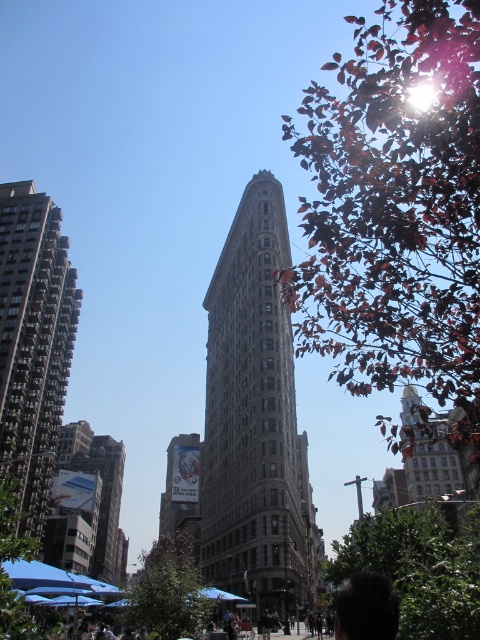
Question: Among these objects, which one is farthest from the camera?

Choices:
 (A) white glossy billboard at center
 (B) green leafy tree at lower right

Answer: (A)

Question: Observing the image, what is the correct spatial positioning of green leafy tree at upper right in reference to white glossy billboard at center?

Choices:
 (A) below
 (B) above

Answer: (B)

Question: Considering the relative positions of green leafy tree at lower center and white glossy billboard at center in the image provided, where is green leafy tree at lower center located with respect to white glossy billboard at center?

Choices:
 (A) above
 (B) below

Answer: (A)

Question: Which of these objects is positioned closest to the green leafy tree at lower left?

Choices:
 (A) white glossy billboard at center
 (B) green leafy tree at upper right
 (C) green leafy tree at lower center

Answer: (C)

Question: Which object appears farthest from the camera in this image?

Choices:
 (A) green leafy tree at lower left
 (B) dark gray concrete building at left
 (C) brown stone building at center
 (D) green leafy tree at upper right

Answer: (C)

Question: Can you confirm if green leafy tree at upper right is bigger than green leafy tree at lower right?

Choices:
 (A) no
 (B) yes

Answer: (B)